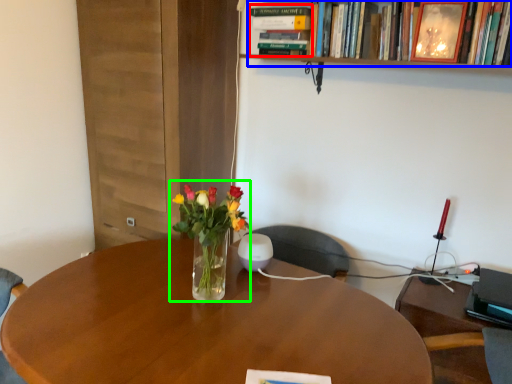
Question: Which is nearer to the book (highlighted by a red box)? book (highlighted by a blue box) or floral arrangement (highlighted by a green box).

Choices:
 (A) book
 (B) floral arrangement

Answer: (A)